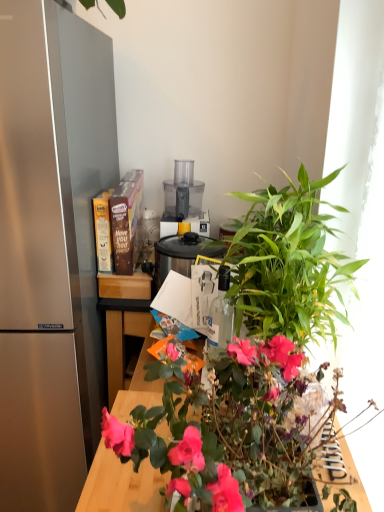
Question: Is transparent plastic food processor at center, the third appliance when ordered from bottom to top, inside the boundaries of green leafy plant at center, or outside?

Choices:
 (A) outside
 (B) inside

Answer: (A)

Question: In terms of height, does transparent plastic food processor at center, marked as the 1th appliance in a top-to-bottom arrangement, look taller or shorter compared to green leafy plant at center?

Choices:
 (A) short
 (B) tall

Answer: (A)

Question: Which object is positioned farthest from the transparent plastic food processor at center, marked as the 1th appliance in a top-to-bottom arrangement?

Choices:
 (A) green leafy plant at center-right
 (B) satin silver blender at center, the 2th appliance from the top
 (C) green leafy plant at center
 (D) black plastic slow cooker at center, the 1th appliance when ordered from bottom to top
 (E) satin silver refrigerator at left

Answer: (C)

Question: Based on their relative distances, which object is farther from the transparent glass bottle at center?

Choices:
 (A) green leafy plant at center-right
 (B) black plastic slow cooker at center, the 1th appliance when ordered from bottom to top
 (C) satin silver refrigerator at left
 (D) satin silver blender at center, the 2th appliance from the top
 (E) transparent plastic food processor at center, marked as the 1th appliance in a top-to-bottom arrangement

Answer: (D)